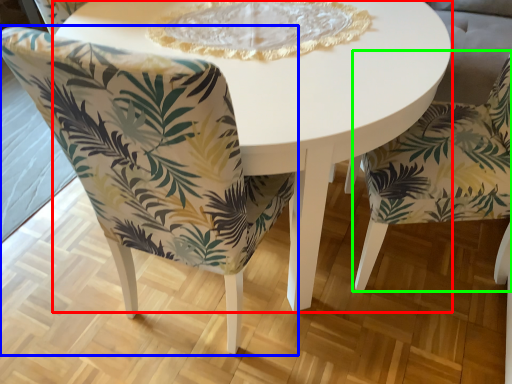
Question: Based on their relative distances, which object is nearer to coffee table (highlighted by a red box)? Choose from chair (highlighted by a blue box) and chair (highlighted by a green box).

Choices:
 (A) chair
 (B) chair

Answer: (A)